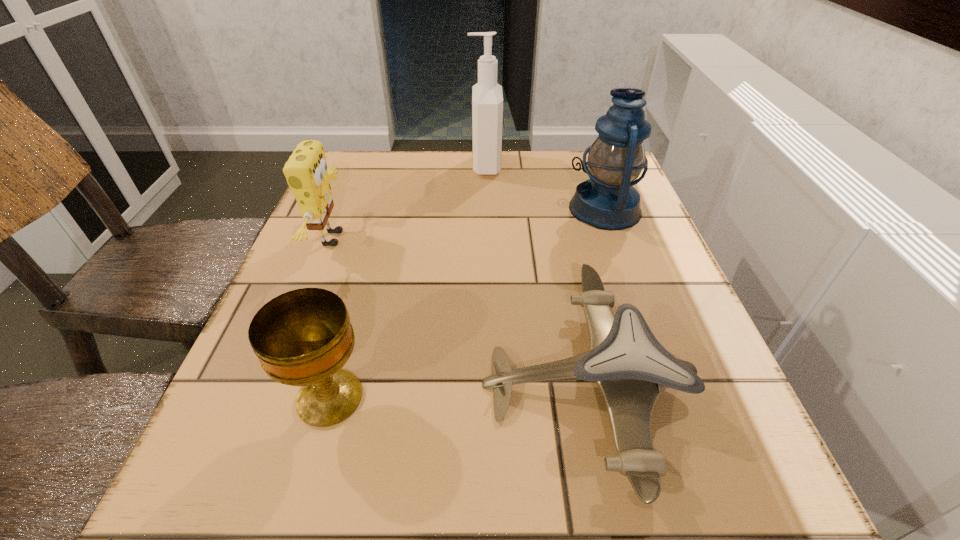
I want to click on the farthest object, so click(487, 97).

Where is `cleansing agent`? cleansing agent is located at coordinates (487, 97).

Find the location of `lantern`. lantern is located at coordinates (608, 201).

You are a GUI agent. You are given a task and a screenshot of the screen. Output one action in this format:
    pyautogui.click(x=<x>, y=<y>)
    Task: Click on the sponge
    The height and width of the screenshot is (540, 960).
    Given the screenshot: What is the action you would take?
    pyautogui.click(x=306, y=171)

Locate an element on the screen. Image resolution: width=960 pixels, height=540 pixels. chalice is located at coordinates (303, 337).

I want to click on drone, so click(631, 368).

The image size is (960, 540). I want to click on vacant position located 0.140m on the front label of the cleansing agent, so click(x=418, y=165).

This screenshot has height=540, width=960. I want to click on vacant space positioned on the front label of the cleansing agent, so [350, 165].

At what (x,y) coordinates should I click in order to perform the action: click on free space located 0.250m on the front label of the cleansing agent. Please return your answer as a coordinate pair (x, y). The width and height of the screenshot is (960, 540). Looking at the image, I should click on (376, 165).

I want to click on free location located 0.370m on the face of the lantern, so click(x=411, y=209).